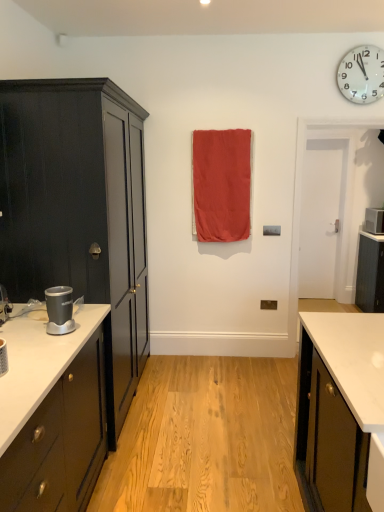
Question: From the image's perspective, is white plastic wall clock at upper right located above or below matte red fabric at center?

Choices:
 (A) above
 (B) below

Answer: (A)

Question: Is white plastic wall clock at upper right inside the boundaries of matte red fabric at center, or outside?

Choices:
 (A) inside
 (B) outside

Answer: (B)

Question: Which is nearer to the matte red fabric at center?

Choices:
 (A) matte black cabinet at left, which ranks as the first cabinetry in left-to-right order
 (B) silver metallic blender at left, which is the first appliance in bottom-to-top order
 (C) white plastic wall clock at upper right
 (D) white plastic microwave at right, the 2th appliance from the bottom
 (E) black matte cabinet at right, which appears as the 1th cabinetry when viewed from the right

Answer: (C)

Question: Considering the real-world distances, which object is closest to the matte red fabric at center?

Choices:
 (A) matte black cabinet at left, which appears as the second cabinetry when viewed from the right
 (B) black matte cabinet at right, which is counted as the first cabinetry, starting from the back
 (C) white plastic wall clock at upper right
 (D) silver metallic blender at left, which is the second appliance in back-to-front order
 (E) white plastic microwave at right, the 2th appliance in the front-to-back sequence

Answer: (C)